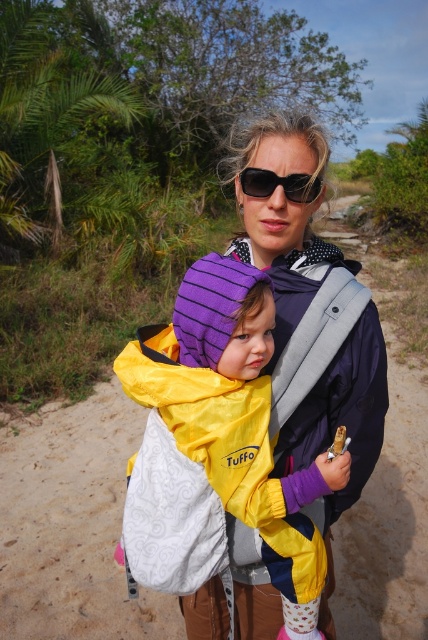
You are a fashion designer observing the two jackets in the image. The yellow fabric jacket at center and the matte black jacket at center. Which one is smaller in size?

The yellow fabric jacket at center occupies less space than matte black jacket at center, so the yellow fabric jacket at center is the smaller one.

You are a photographer trying to capture the woman and child in the image. To ensure the matte black jacket at center is in focus, where should you aim your camera lens?

You should aim your camera lens at point (282, 212) to focus on the matte black jacket at center.

Looking at this image, the woman is wearing a matte black jacket at center and black plastic sunglasses at center. Which item is closer to the camera?

The matte black jacket at center is closer to the camera than the black plastic sunglasses at center.